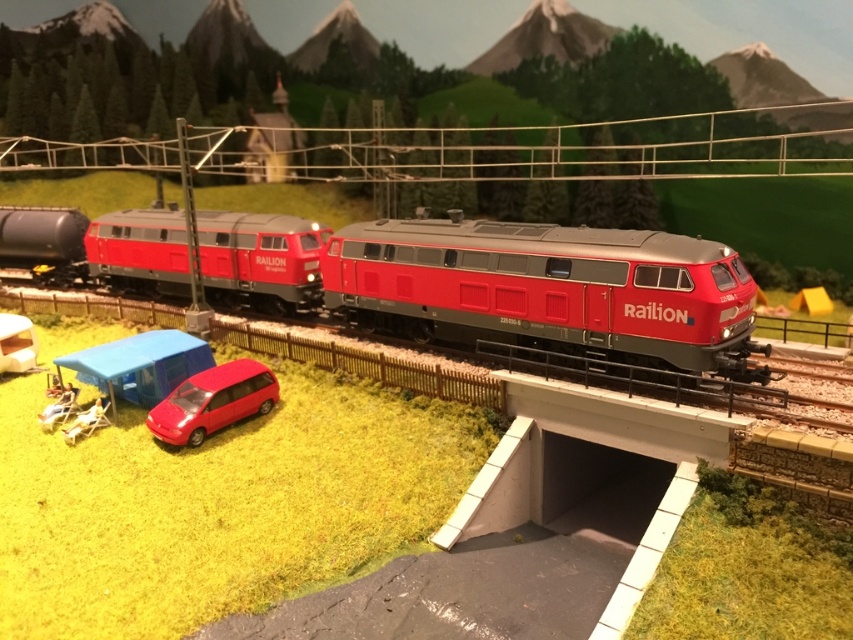
Can you confirm if matte red locomotive at center is smaller than glossy red minivan at lower center?

No, matte red locomotive at center is not smaller than glossy red minivan at lower center.

Is matte red locomotive at center shorter than glossy red minivan at lower center?

No, matte red locomotive at center is not shorter than glossy red minivan at lower center.

Where is `matte red locomotive at center`? The width and height of the screenshot is (853, 640). matte red locomotive at center is located at coordinates (508, 285).

Where is `matte red locomotive at center`? The image size is (853, 640). matte red locomotive at center is located at coordinates (508, 285).